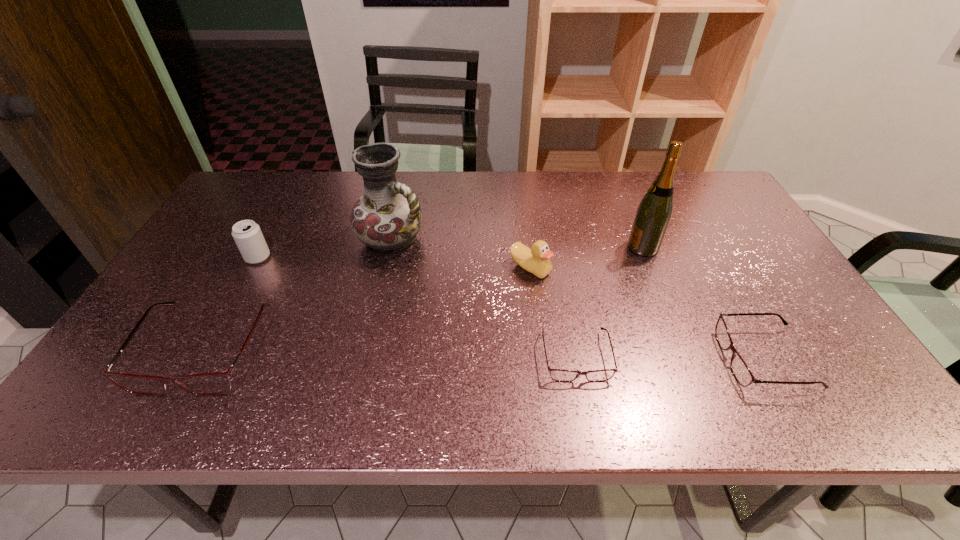
To achieve even spacing by inserting another spectacles among them, please point to a vacant spot for this new spectacles. Please provide its 2D coordinates. Your answer should be formatted as a tuple, i.e. [(x, y)], where the tuple contains the x and y coordinates of a point satisfying the conditions above.

[(390, 352)]